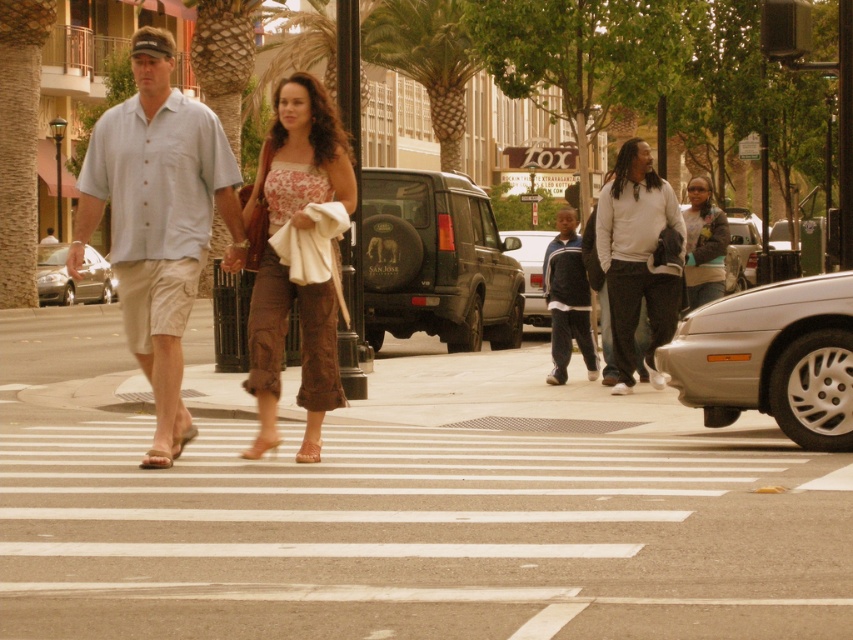
You are a delivery person standing at the crosswalk and need to place a package on the ground. The package requires a flat surface that is at least 30 feet away from the matte black suv at center. Can you place the package on the brown leather sandal at center?

The matte black suv at center and brown leather sandal at center are 29.82 feet apart from each other. Since the required distance is 30 feet, the sandal is too close to the SUV to place the package there.

You are standing at the pedestrian crossing and want to determine which of the two points, point (700, 240) or point (308, 449), is closer to you. Based on the scene description, which point is nearer?

Point (700, 240) is further to the viewer than point (308, 449). Therefore, point (308, 449) is closer to you.